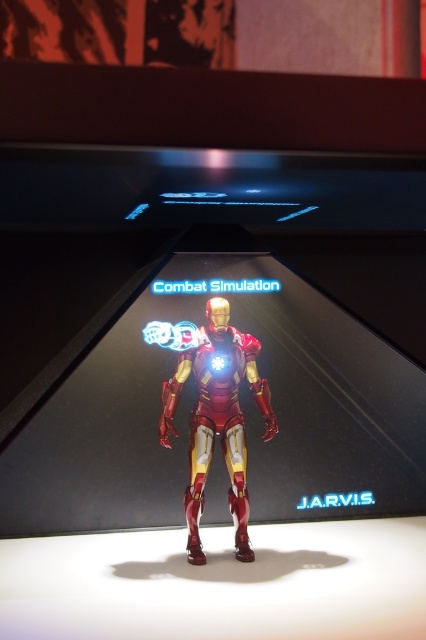
Question: Where is metallic iron man at center located in relation to shiny metallic iron man at center in the image?

Choices:
 (A) above
 (B) below

Answer: (A)

Question: Is metallic iron man at center wider than shiny metallic iron man at center?

Choices:
 (A) yes
 (B) no

Answer: (A)

Question: Is metallic iron man at center positioned at the back of shiny metallic iron man at center?

Choices:
 (A) no
 (B) yes

Answer: (B)

Question: Which point is closer to the camera?

Choices:
 (A) (11, 474)
 (B) (261, 390)

Answer: (B)